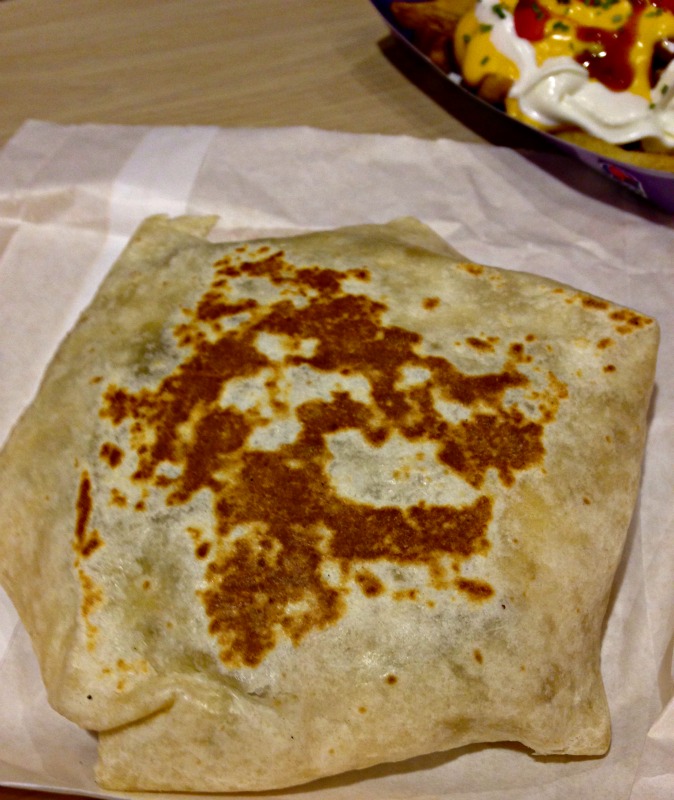
Locate an element on the screen. table is located at coordinates (193, 69).